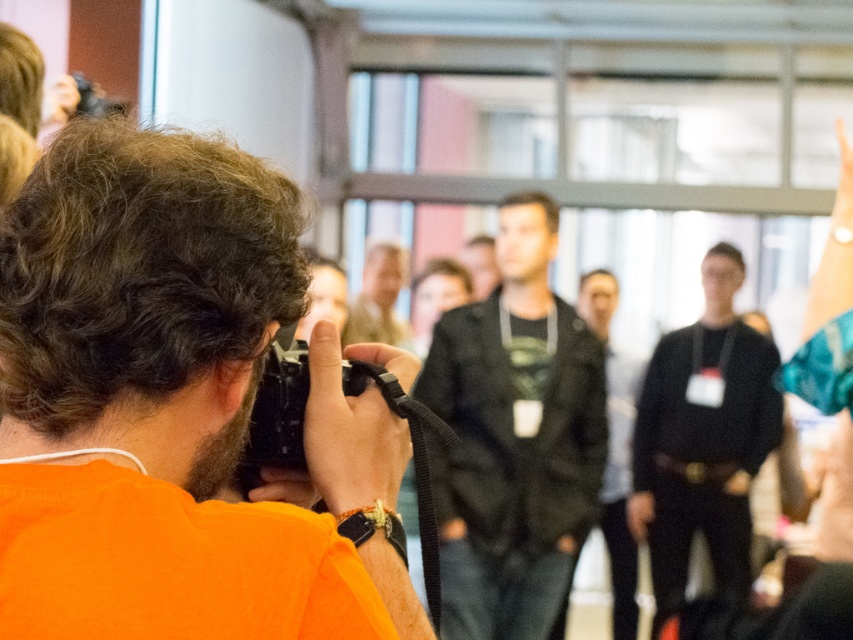
Question: Which point appears farthest from the camera in this image?

Choices:
 (A) (293, 211)
 (B) (701, 429)

Answer: (B)

Question: Is black leather jacket at center wider than dark green jacket at center?

Choices:
 (A) no
 (B) yes

Answer: (B)

Question: Does black leather jacket at center have a smaller size compared to black plastic camera at center?

Choices:
 (A) yes
 (B) no

Answer: (B)

Question: Is orange fabric shirt at center thinner than dark green jacket at center?

Choices:
 (A) yes
 (B) no

Answer: (B)

Question: Estimate the real-world distances between objects in this image. Which object is farther from the dark green jacket at center?

Choices:
 (A) black plastic camera at center
 (B) black matte sweater at center
 (C) orange fabric shirt at center

Answer: (C)

Question: Which point is farther from the camera taking this photo?

Choices:
 (A) (589, 506)
 (B) (374, 369)
 (C) (16, 436)

Answer: (A)